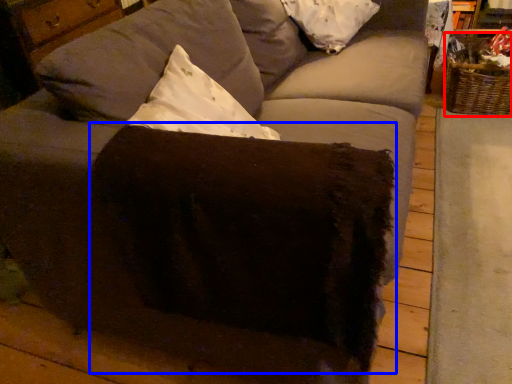
Question: Which object is closer to the camera taking this photo, basket (highlighted by a red box) or swivel chair (highlighted by a blue box)?

Choices:
 (A) basket
 (B) swivel chair

Answer: (B)